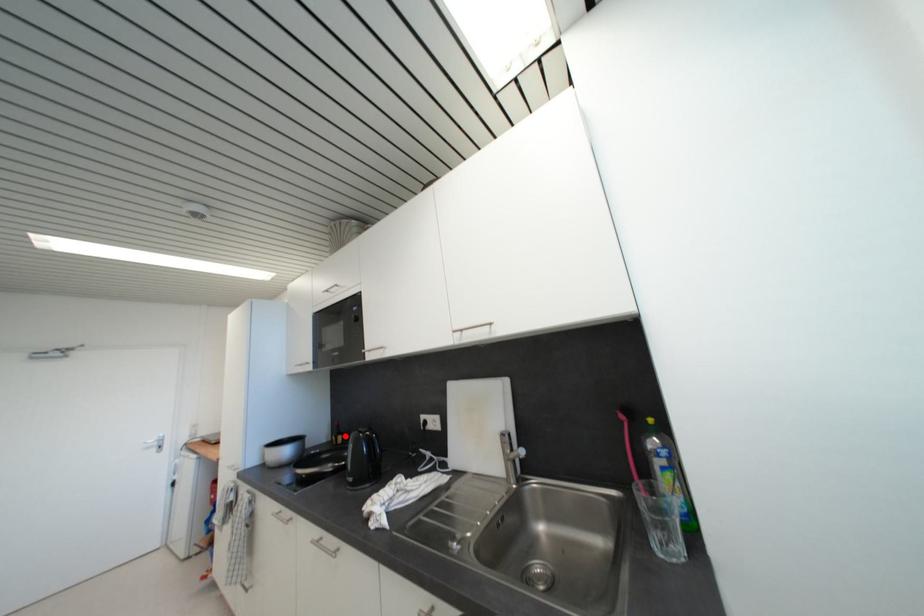
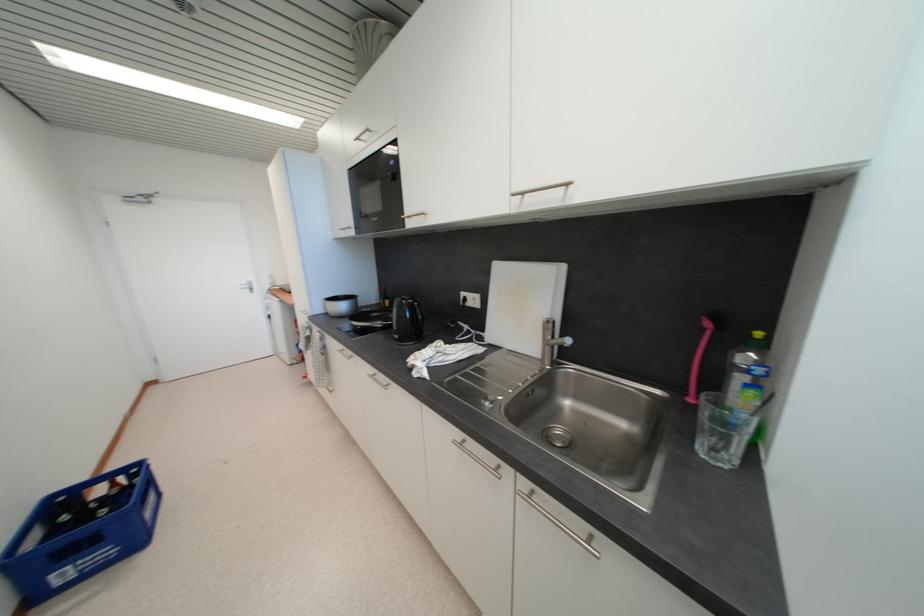
Find the pixel in the second image that matches the highlighted location in the first image.

(392, 301)